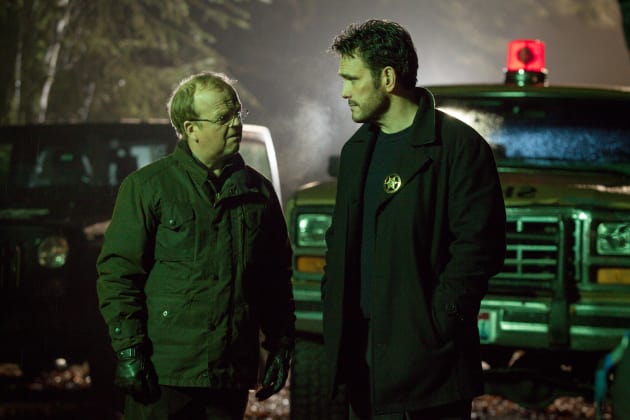
Image resolution: width=630 pixels, height=420 pixels. What are the coordinates of `red bulb` in the screenshot? It's located at (518, 57).